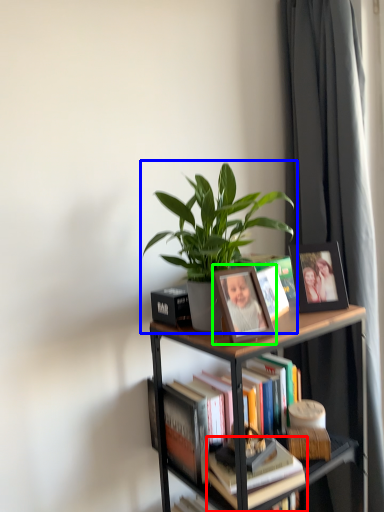
Question: Based on their relative distances, which object is nearer to book (highlighted by a red box)? Choose from houseplant (highlighted by a blue box) and picture frame (highlighted by a green box).

Choices:
 (A) houseplant
 (B) picture frame

Answer: (B)